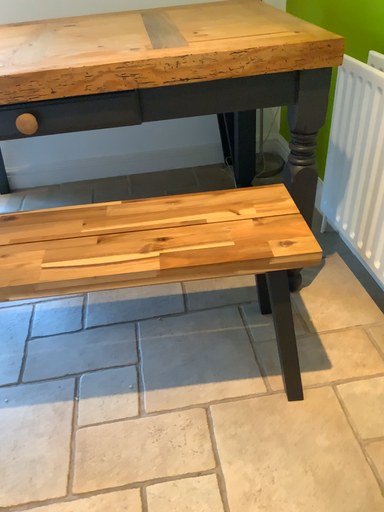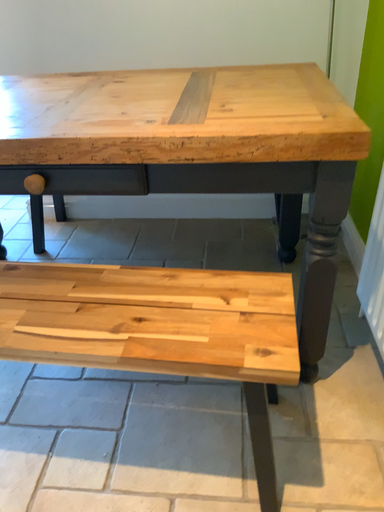
Question: How did the camera likely rotate when shooting the video?

Choices:
 (A) rotated right
 (B) rotated left

Answer: (B)